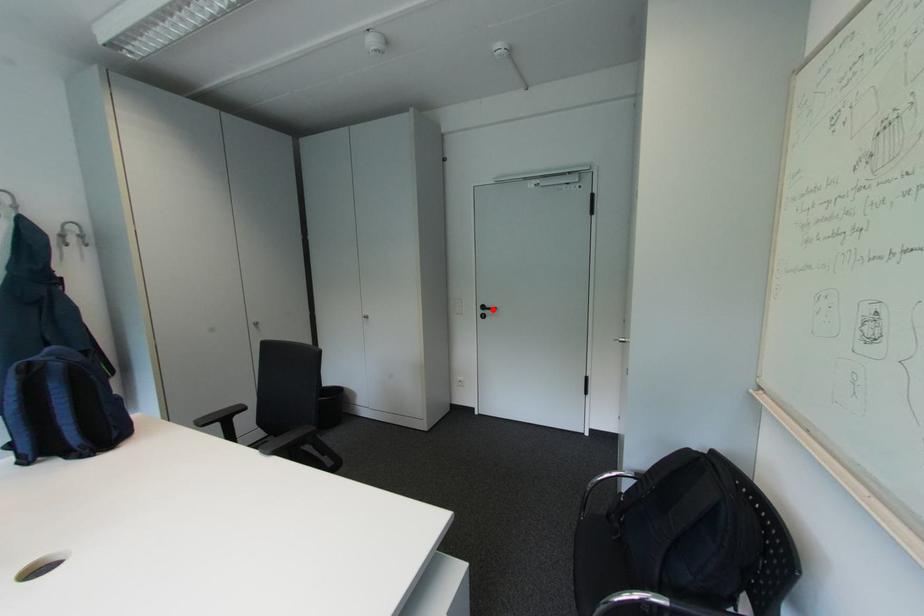
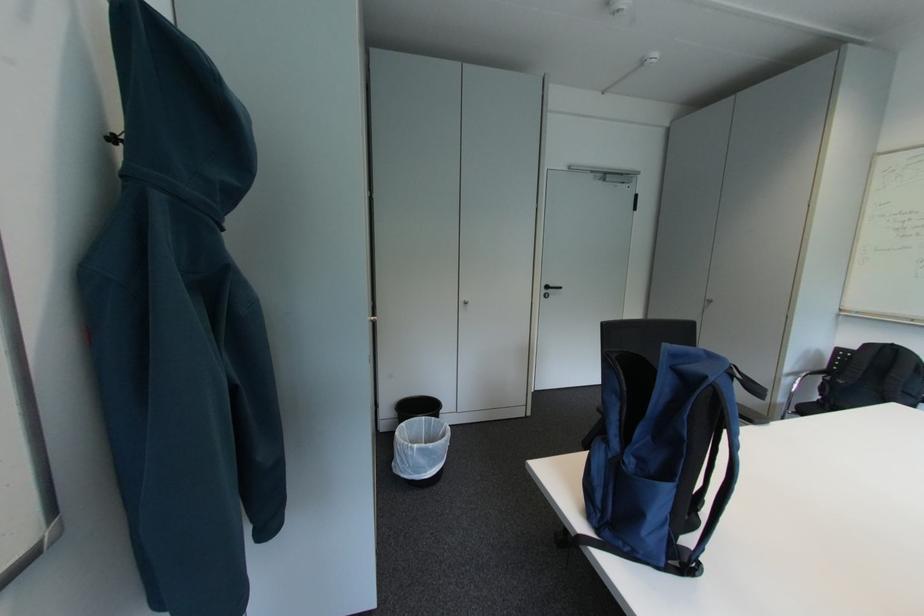
Where in the second image is the point corresponding to the highlighted location from the first image?

(556, 289)